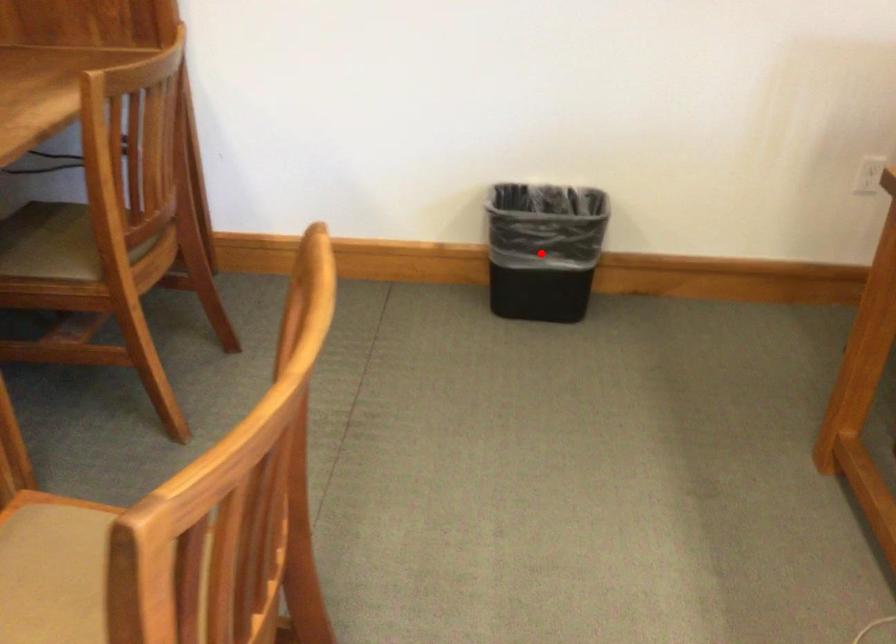
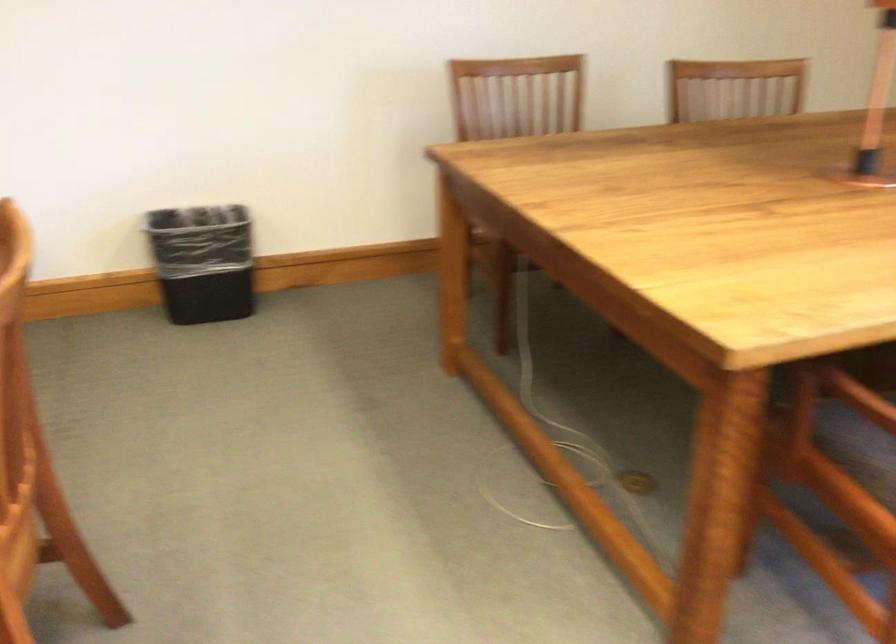
Question: I am providing you with two images of the same scene from different viewpoints. Image1 has a red point marked. In image2, the corresponding 3D location appears at what relative position? Reply with the corresponding letter.

Choices:
 (A) Closer
 (B) Farther

Answer: (B)